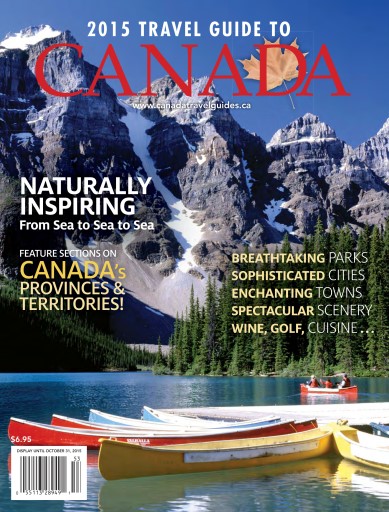
This screenshot has height=512, width=389. What are the coordinates of `magazine` in the screenshot? It's located at (329, 77), (211, 202).